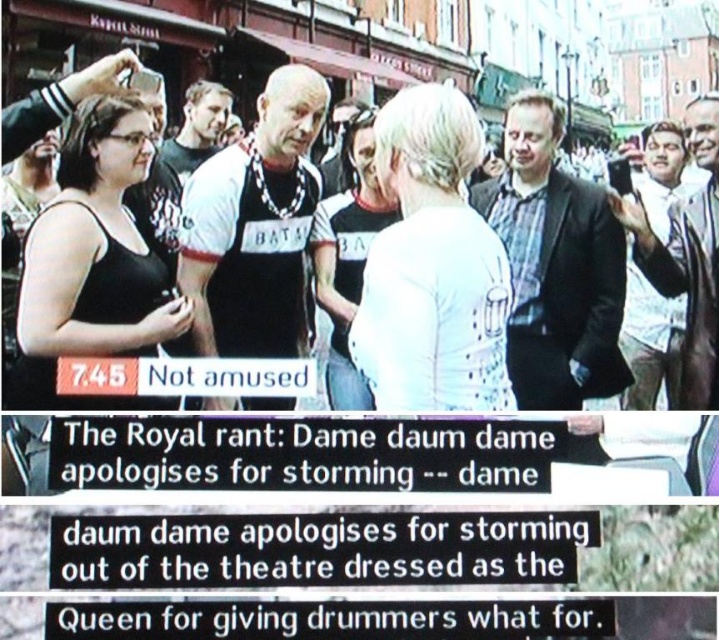
Does white matte shirt at center come in front of black matte tank top at left?

That is False.

Based on the photo, between white matte shirt at center and black matte tank top at left, which one is positioned lower?

white matte shirt at center is below.

Does point (470, 355) come closer to viewer compared to point (114, 212)?

Yes, it is.

Find the location of `white matte shirt at center`. white matte shirt at center is located at coordinates (431, 266).

Is white matte shirt at center taller than black fabric crowd at center?

No.

Is white matte shirt at center above black fabric crowd at center?

Actually, white matte shirt at center is below black fabric crowd at center.

Who is more distant from viewer, [416,193] or [664,227]?

The point [664,227] is behind.

Locate an element on the screen. The height and width of the screenshot is (640, 719). white matte shirt at center is located at coordinates (431, 266).

Can you confirm if black matte tank top at left is positioned above black fabric crowd at center?

No.

This screenshot has width=719, height=640. What are the coordinates of `black matte tank top at left` in the screenshot? It's located at [x=93, y=260].

What do you see at coordinates (93, 260) in the screenshot?
I see `black matte tank top at left` at bounding box center [93, 260].

Image resolution: width=719 pixels, height=640 pixels. I want to click on black matte tank top at left, so click(93, 260).